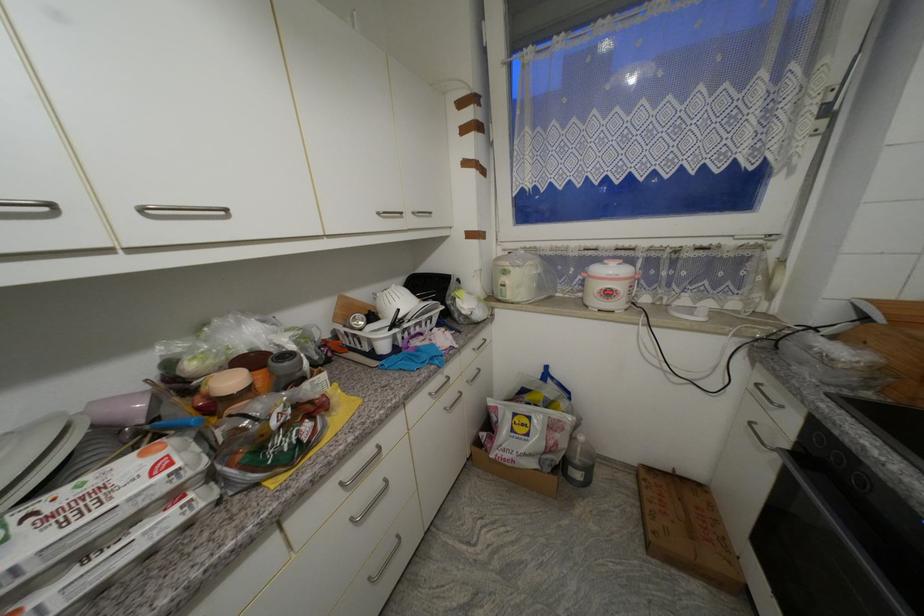
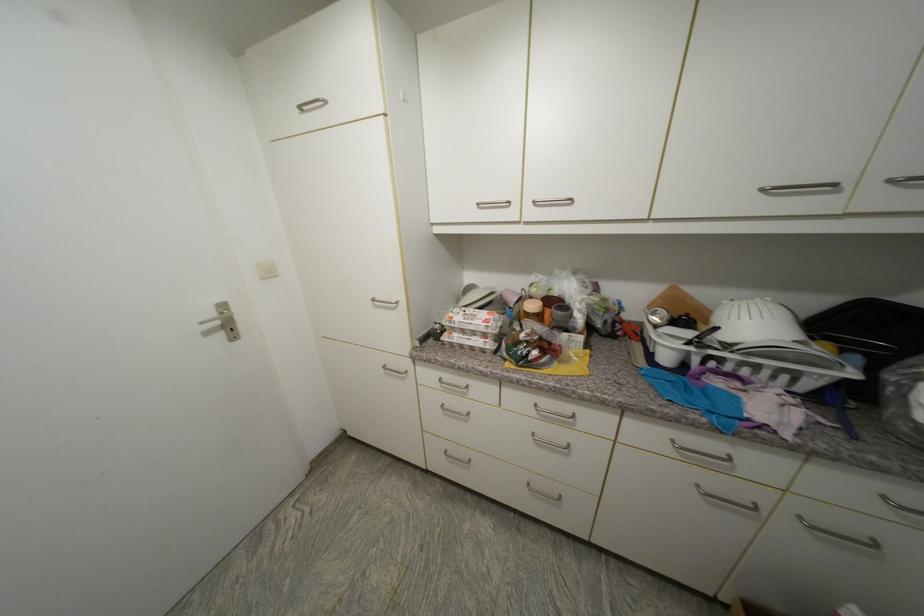
Locate, in the second image, the point that corresponds to point (178, 498) in the first image.

(490, 337)